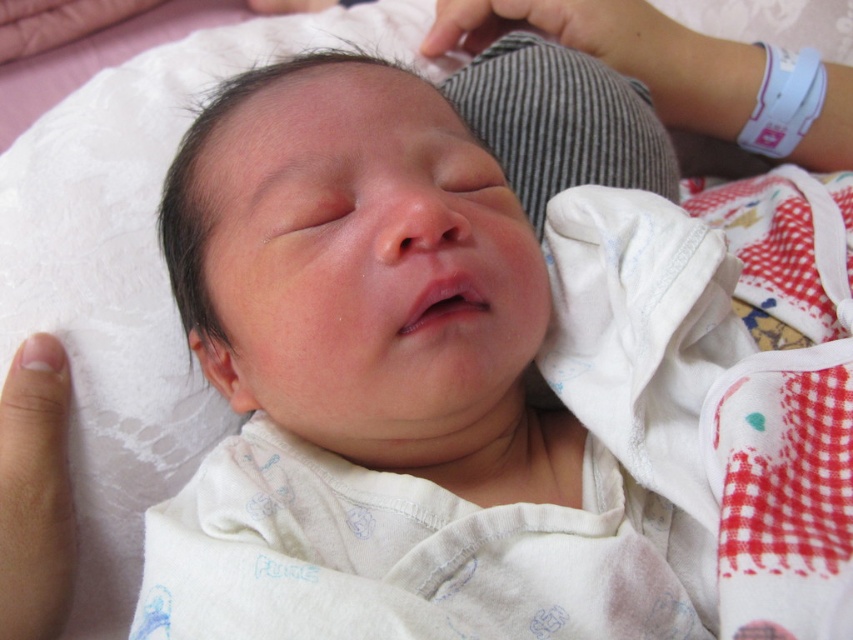
Question: Which of the following is the farthest from the observer?

Choices:
 (A) (62, 499)
 (B) (602, 422)

Answer: (A)

Question: Does smooth skin newborn at center appear on the left side of smooth skin finger at lower left?

Choices:
 (A) yes
 (B) no

Answer: (B)

Question: Which point is farther to the camera?

Choices:
 (A) (28, 531)
 (B) (498, 460)

Answer: (B)

Question: Is smooth skin newborn at center smaller than smooth skin finger at lower left?

Choices:
 (A) no
 (B) yes

Answer: (A)

Question: Does smooth skin newborn at center appear on the right side of smooth skin finger at lower left?

Choices:
 (A) no
 (B) yes

Answer: (B)

Question: Among these objects, which one is farthest from the camera?

Choices:
 (A) smooth skin newborn at center
 (B) smooth skin finger at lower left

Answer: (B)